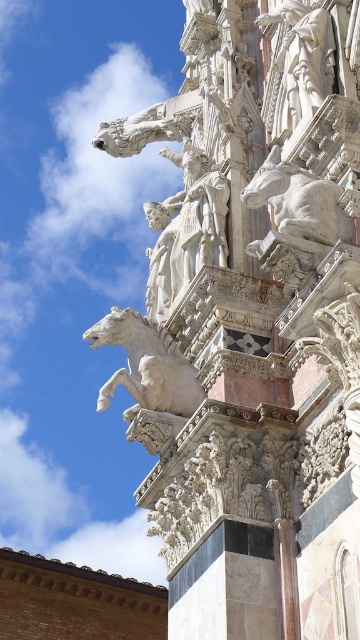
Is white marble statue at center positioned in front of white marble horse at upper center?

No, it is not.

Is point (154, 248) farther from viewer compared to point (185, 394)?

Yes, point (154, 248) is farther from viewer.

Is point (181, 289) positioned in front of point (164, 397)?

That is False.

Identify the location of white marble statue at center. (186, 228).